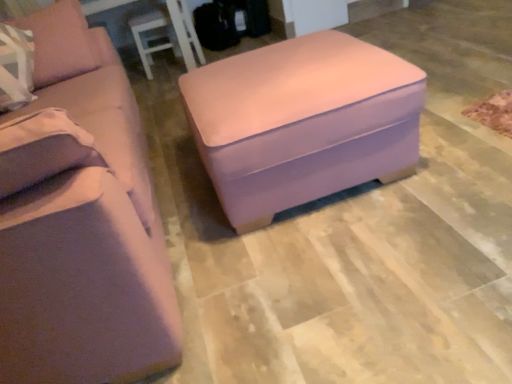
Question: Considering the relative positions of suede-like beige pillow at left and matte pink ottoman at center in the image provided, is suede-like beige pillow at left to the left or to the right of matte pink ottoman at center?

Choices:
 (A) left
 (B) right

Answer: (A)

Question: From the image's perspective, is suede-like beige pillow at left above or below matte pink ottoman at center?

Choices:
 (A) above
 (B) below

Answer: (A)

Question: Estimate the real-world distances between objects in this image. Which object is closer to the matte pink ottoman at center?

Choices:
 (A) suede-like beige pillow at left
 (B) matte pink fabric studio couch at center

Answer: (B)

Question: Based on their relative distances, which object is nearer to the matte pink fabric studio couch at center?

Choices:
 (A) matte pink ottoman at center
 (B) suede-like beige pillow at left

Answer: (B)